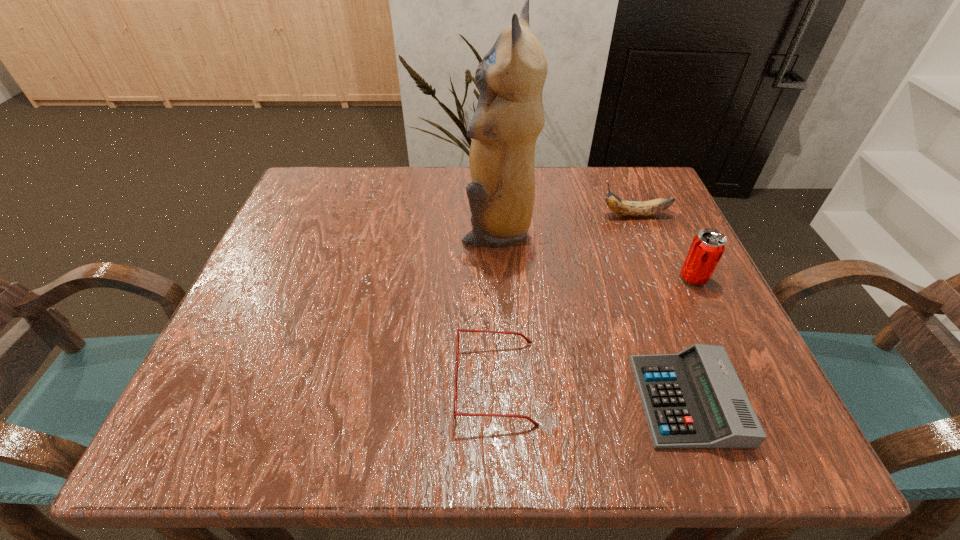
The width and height of the screenshot is (960, 540). What are the coordinates of `vacant point that satisfies the following two spatial constraints: 1. on the face of the fourth shortest object; 2. on the left side of the tallest object` in the screenshot? It's located at (499, 278).

This screenshot has height=540, width=960. I want to click on vacant space that satisfies the following two spatial constraints: 1. on the face of the tallest object; 2. on the left side of the shortest object, so click(505, 400).

Find the location of `vacant space that satisfies the following two spatial constraints: 1. at the stem of the banana; 2. on the left side of the third farthest object`. vacant space that satisfies the following two spatial constraints: 1. at the stem of the banana; 2. on the left side of the third farthest object is located at coordinates (660, 278).

Identify the location of vacant space that satisfies the following two spatial constraints: 1. on the face of the tallest object; 2. on the right side of the third farthest object. The width and height of the screenshot is (960, 540). (499, 278).